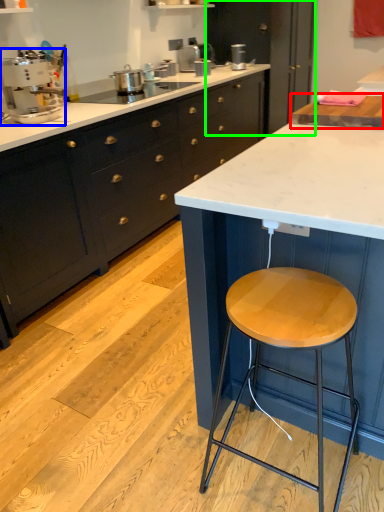
Question: Based on their relative distances, which object is nearer to countertop (highlighted by a red box)? Choose from appliance (highlighted by a blue box) and cabinetry (highlighted by a green box).

Choices:
 (A) appliance
 (B) cabinetry

Answer: (A)